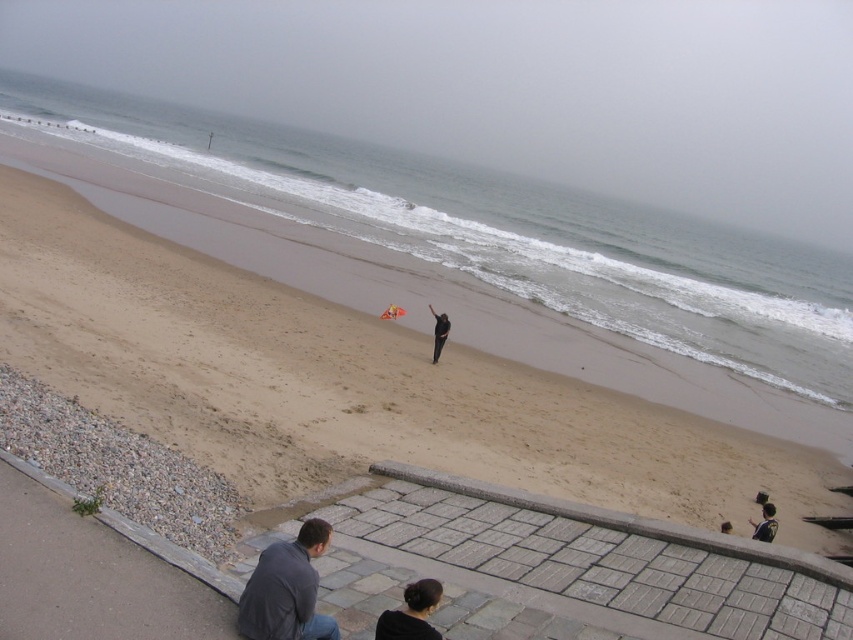
Consider the image. Can you confirm if black matte hair at lower center is smaller than orange fabric kite at center?

Yes, black matte hair at lower center is smaller than orange fabric kite at center.

Which is in front, point (440, 596) or point (384, 316)?

Point (440, 596) is more forward.

The height and width of the screenshot is (640, 853). Find the location of `black matte hair at lower center`. black matte hair at lower center is located at coordinates (410, 612).

This screenshot has height=640, width=853. In order to click on black matte hair at lower center in this screenshot , I will do (x=410, y=612).

Looking at this image, between brown sandy beach at center and dark gray sweater at lower right, which one appears on the right side from the viewer's perspective?

Positioned to the right is dark gray sweater at lower right.

Who is higher up, brown sandy beach at center or dark gray sweater at lower right?

Positioned higher is brown sandy beach at center.

Who is more forward, (x=181, y=218) or (x=727, y=529)?

Point (x=727, y=529)

Find the location of `brown sandy beach at center`. brown sandy beach at center is located at coordinates (x=424, y=294).

This screenshot has width=853, height=640. What do you see at coordinates (287, 589) in the screenshot?
I see `dark gray fabric jacket at lower center` at bounding box center [287, 589].

Based on the photo, does dark gray fabric jacket at lower center have a greater height compared to black matte hair at lower center?

Yes.

The height and width of the screenshot is (640, 853). I want to click on dark gray fabric jacket at lower center, so click(287, 589).